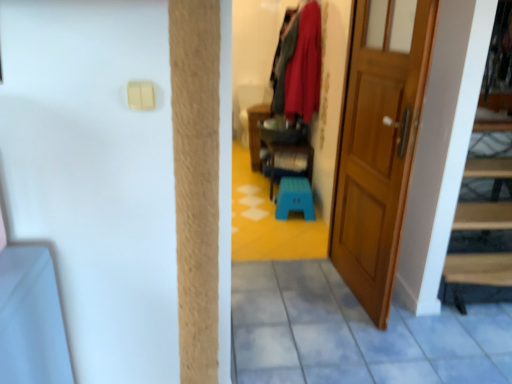
Locate an element on the screen. The image size is (512, 384). empty space that is ontop of blue plastic step stool at center is located at coordinates (295, 186).